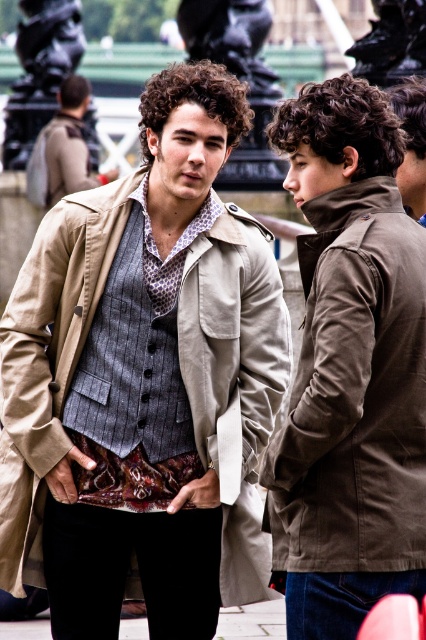
Question: Which is nearer to the beige fabric coat at center?

Choices:
 (A) matte brown jacket at center
 (B) matte brown jacket at right

Answer: (B)

Question: Among these objects, which one is nearest to the camera?

Choices:
 (A) beige fabric coat at center
 (B) matte brown jacket at right
 (C) matte brown jacket at center

Answer: (B)

Question: Where is matte brown jacket at right located in relation to beige fabric coat at center in the image?

Choices:
 (A) right
 (B) left

Answer: (A)

Question: Can you confirm if matte brown jacket at right is positioned above beige fabric coat at center?

Choices:
 (A) no
 (B) yes

Answer: (B)

Question: Is matte brown jacket at right bigger than matte brown jacket at center?

Choices:
 (A) no
 (B) yes

Answer: (A)

Question: Among these objects, which one is farthest from the camera?

Choices:
 (A) matte brown jacket at right
 (B) beige fabric coat at center
 (C) matte brown jacket at center

Answer: (C)